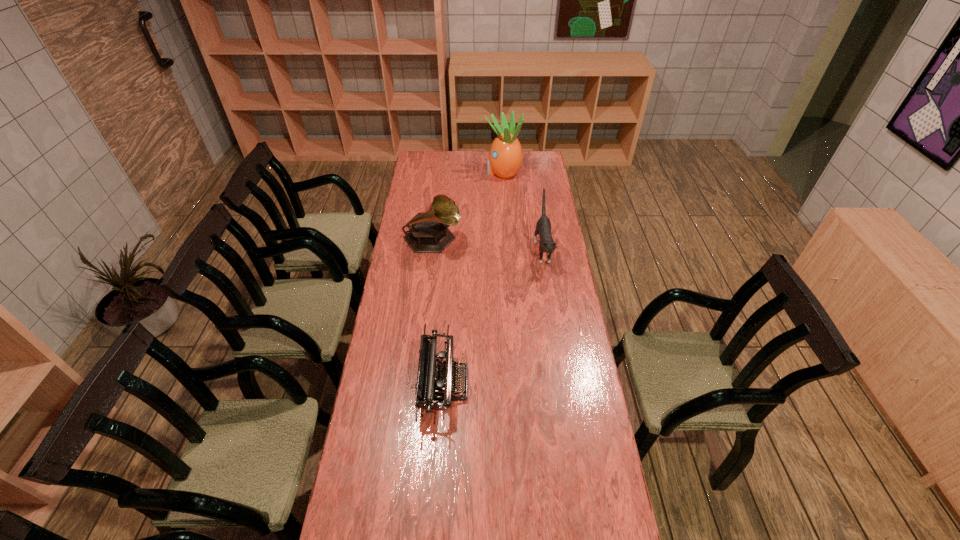
Where is `the second object from right to left`? The width and height of the screenshot is (960, 540). the second object from right to left is located at coordinates (505, 158).

This screenshot has height=540, width=960. In order to click on the farthest object in this screenshot , I will do `click(505, 158)`.

This screenshot has width=960, height=540. I want to click on phonograph record, so click(428, 232).

The height and width of the screenshot is (540, 960). In order to click on cat in this screenshot , I will do `click(543, 227)`.

At what (x,y) coordinates should I click in order to perform the action: click on typewriter. Please return your answer as a coordinate pair (x, y). Looking at the image, I should click on (435, 382).

Find the location of a particular element. the shortest object is located at coordinates (435, 382).

Identify the location of vacant space located at the entrance of the tallest object. This screenshot has height=540, width=960. (460, 172).

Where is `vacant space situated at the entrance of the tallest object`? Image resolution: width=960 pixels, height=540 pixels. vacant space situated at the entrance of the tallest object is located at coordinates (443, 172).

Identify the location of vacant region located 0.370m at the entrance of the tallest object. This screenshot has width=960, height=540. (420, 172).

This screenshot has width=960, height=540. Identify the location of vacant space located 0.250m on the horn direction of the phonograph record. (515, 240).